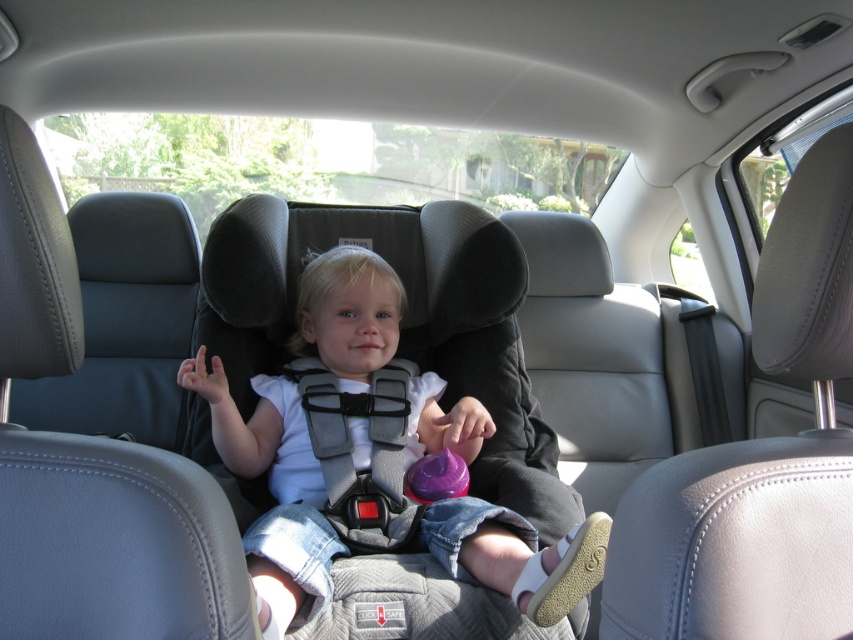
Which is above, matte gray car seat at center or gray fabric safety vest at center?

gray fabric safety vest at center

Can you confirm if matte gray car seat at center is bigger than gray fabric safety vest at center?

Yes.

Does point (584, 524) come closer to viewer compared to point (326, 424)?

Yes, it is in front of point (326, 424).

Where is `matte gray car seat at center`? matte gray car seat at center is located at coordinates (273, 490).